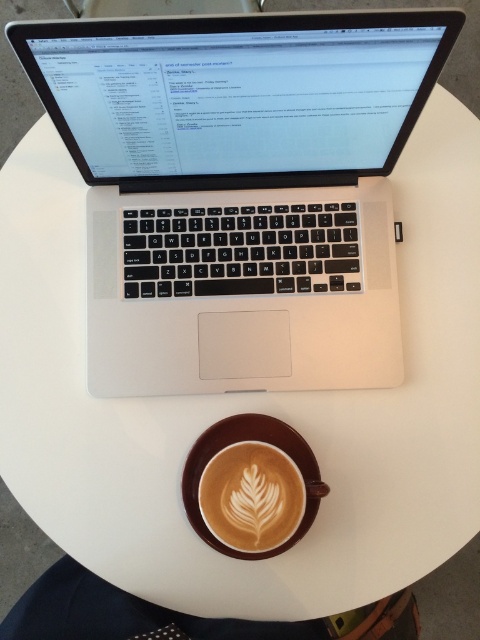
Question: Among these objects, which one is farthest from the camera?

Choices:
 (A) white frothy art at center
 (B) silver metallic laptop at upper center

Answer: (A)

Question: Can you confirm if silver metallic laptop at upper center is thinner than white frothy art at center?

Choices:
 (A) no
 (B) yes

Answer: (A)

Question: Among these points, which one is farthest from the camera?

Choices:
 (A) (135, 243)
 (B) (230, 444)

Answer: (A)

Question: Can you confirm if silver metallic laptop at upper center is positioned to the left of white frothy art at center?

Choices:
 (A) no
 (B) yes

Answer: (B)

Question: Does silver metallic laptop at upper center have a greater width compared to white frothy art at center?

Choices:
 (A) no
 (B) yes

Answer: (B)

Question: Which point appears closest to the camera in this image?

Choices:
 (A) (360, 132)
 (B) (238, 483)

Answer: (B)